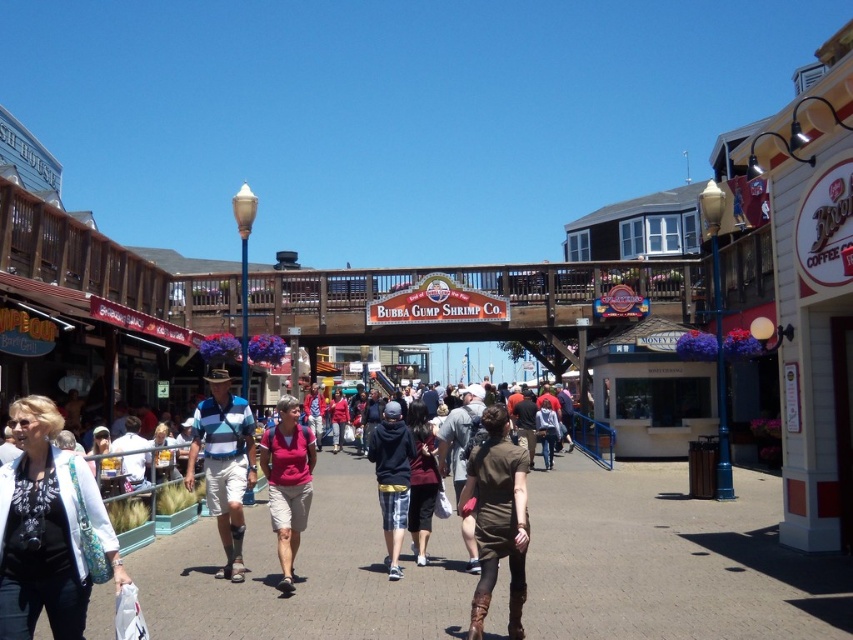
You are a photographer standing at the end of the boardwalk, aiming to capture a shot of the white fabric jacket at lower left and the dark blue hoodie at center. If you want to ensure both subjects are in focus, which jacket should you prioritize positioning closer to the camera?

The white fabric jacket at lower left might be wider than the dark blue hoodie at center, so positioning the wider jacket closer to the camera would help ensure both are in focus.

In the scene shown: You are a photographer standing on the boardwalk and want to capture both the white fabric jacket at lower left and the dark blue hoodie at center in the same frame. Which jacket is closer to you?

The white fabric jacket at lower left is closer to you since it is in front of the dark blue hoodie at center.

You are a photographer standing on the boardwalk and want to capture both the white fabric jacket at lower left and the dark blue hoodie at center in a single shot. Which jacket is positioned lower in the frame?

The white fabric jacket at lower left is positioned lower in the frame than the dark blue hoodie at center.